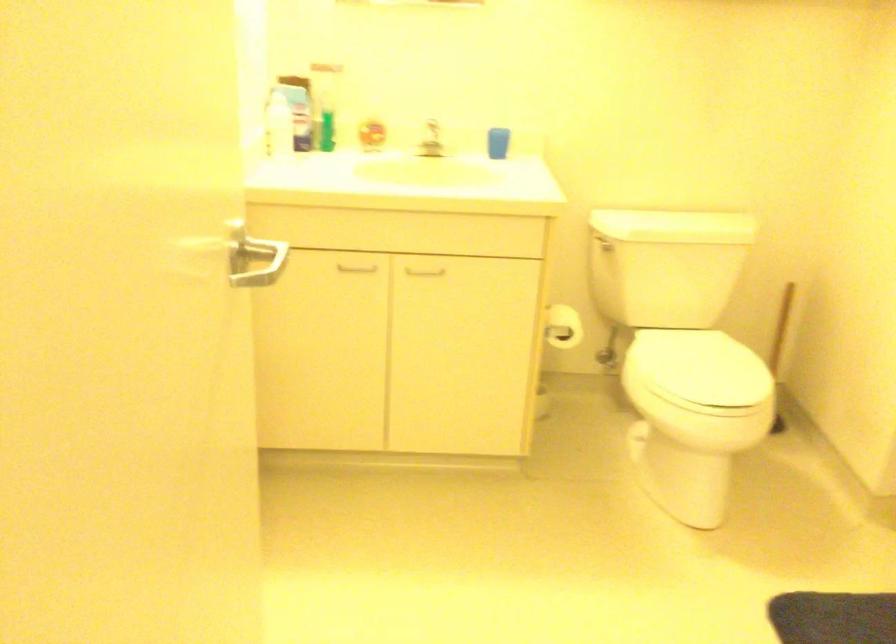
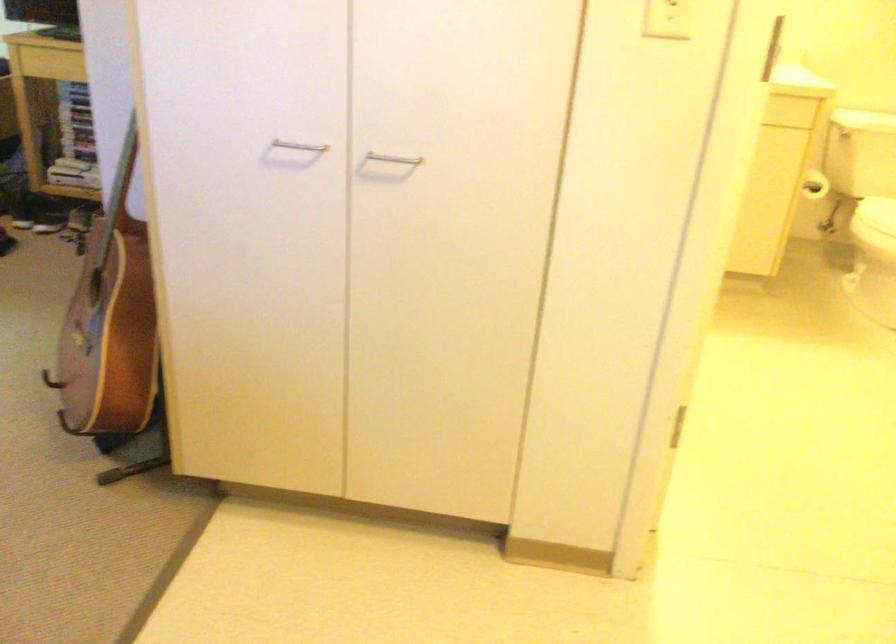
Question: I am providing you with two images of the same scene from different viewpoints. After the viewpoint changes to image2, which objects are now occluded?

Choices:
 (A) toilet paper roll
 (B) milk can handle
 (C) white toilet lid
 (D) white cabinet handle

Answer: (D)